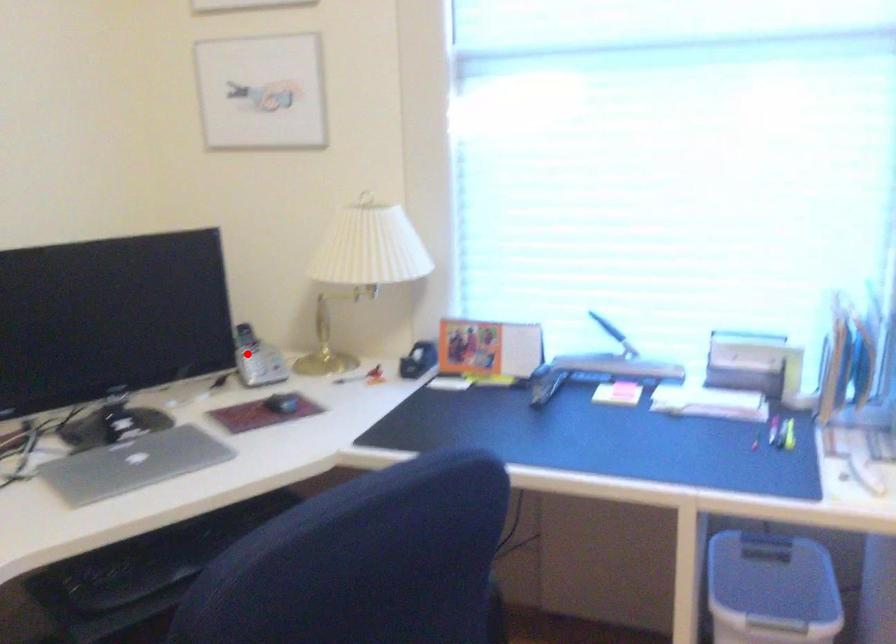
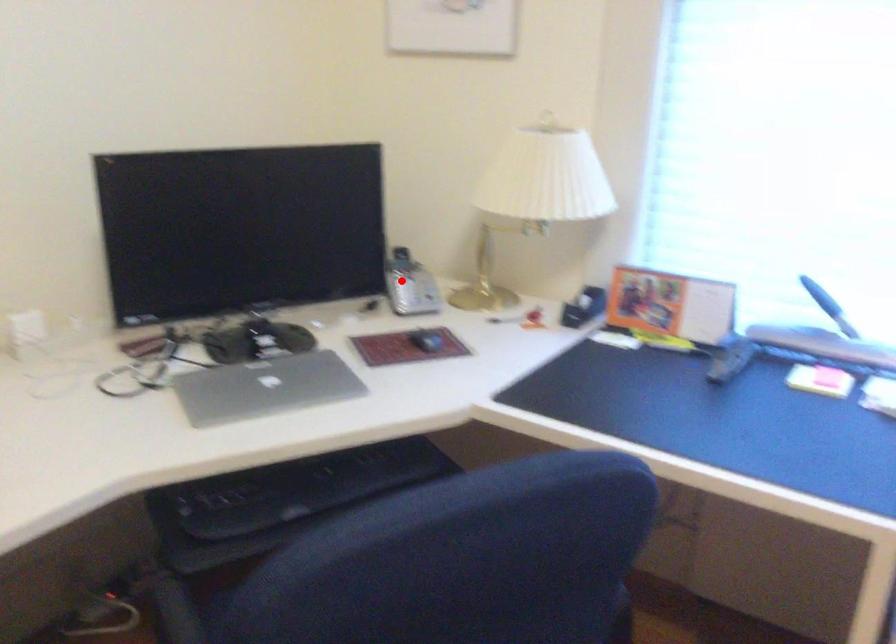
Consider the image. I am providing you with two images of the same scene from different viewpoints. A red point is marked on the first image and another point is marked on the second image. Is the marked point in image1 the same physical position as the marked point in image2?

Yes